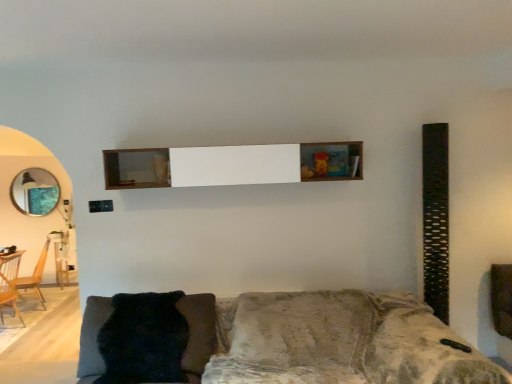
Question: Is wooden shelf at center next to velvet-like gray couch at lower center and touching it?

Choices:
 (A) yes
 (B) no

Answer: (B)

Question: Is wooden shelf at center thinner than velvet-like gray couch at lower center?

Choices:
 (A) yes
 (B) no

Answer: (A)

Question: Considering the relative positions of wooden shelf at center and velvet-like gray couch at lower center in the image provided, is wooden shelf at center to the right of velvet-like gray couch at lower center from the viewer's perspective?

Choices:
 (A) no
 (B) yes

Answer: (A)

Question: Is the depth of wooden shelf at center greater than that of velvet-like gray couch at lower center?

Choices:
 (A) no
 (B) yes

Answer: (B)

Question: Considering the relative sizes of wooden shelf at center and velvet-like gray couch at lower center in the image provided, is wooden shelf at center shorter than velvet-like gray couch at lower center?

Choices:
 (A) yes
 (B) no

Answer: (A)

Question: Considering the relative positions of wooden shelf at center and velvet-like gray couch at lower center in the image provided, is wooden shelf at center in front of velvet-like gray couch at lower center?

Choices:
 (A) yes
 (B) no

Answer: (B)

Question: Does wooden armchair at left, which ranks as the second armchair in front-to-back order, turn towards wooden shelf at center?

Choices:
 (A) yes
 (B) no

Answer: (B)

Question: Is wooden shelf at center surrounded by wooden armchair at left, marked as the 1th armchair in a back-to-front arrangement?

Choices:
 (A) no
 (B) yes

Answer: (A)

Question: Is wooden armchair at left, which ranks as the second armchair in front-to-back order, facing away from wooden shelf at center?

Choices:
 (A) yes
 (B) no

Answer: (B)

Question: Is wooden armchair at left, marked as the 1th armchair in a back-to-front arrangement, beside wooden shelf at center?

Choices:
 (A) yes
 (B) no

Answer: (B)

Question: Considering the relative sizes of wooden armchair at left, which ranks as the second armchair in front-to-back order, and wooden shelf at center in the image provided, is wooden armchair at left, which ranks as the second armchair in front-to-back order, shorter than wooden shelf at center?

Choices:
 (A) yes
 (B) no

Answer: (B)

Question: Can you confirm if wooden armchair at left, marked as the 1th armchair in a back-to-front arrangement, is taller than wooden shelf at center?

Choices:
 (A) no
 (B) yes

Answer: (B)

Question: Can you confirm if wooden armchair at left, which is counted as the 2th armchair, starting from the back, is taller than velvet-like gray couch at lower center?

Choices:
 (A) no
 (B) yes

Answer: (B)